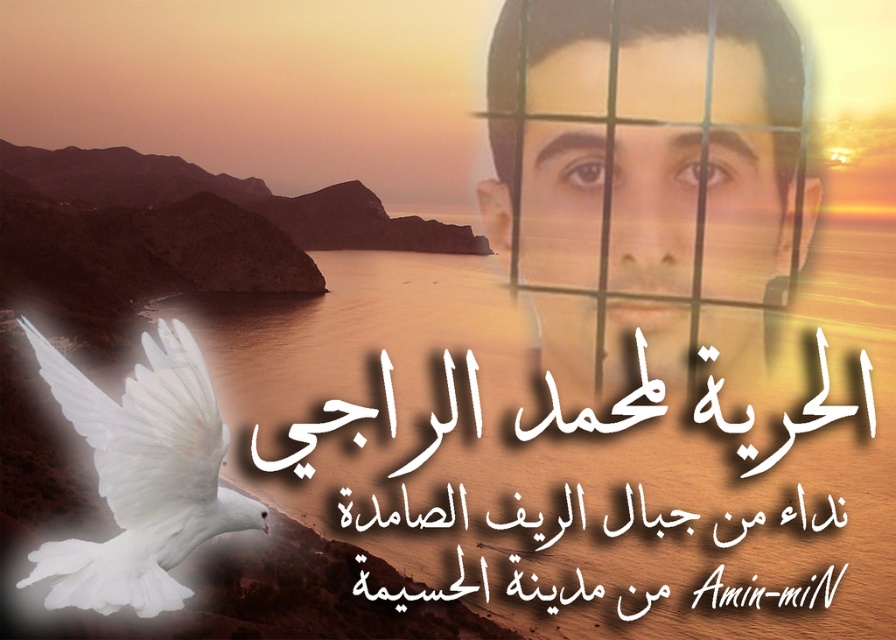
Who is positioned more to the left, smooth skin face at upper right or white feathered dove at lower left?

white feathered dove at lower left is more to the left.

Can you confirm if smooth skin face at upper right is shorter than white feathered dove at lower left?

In fact, smooth skin face at upper right may be taller than white feathered dove at lower left.

Between point (514, 8) and point (207, 529), which one is positioned in front?

Point (207, 529) is more forward.

Image resolution: width=896 pixels, height=640 pixels. In order to click on smooth skin face at upper right in this screenshot , I will do `click(648, 145)`.